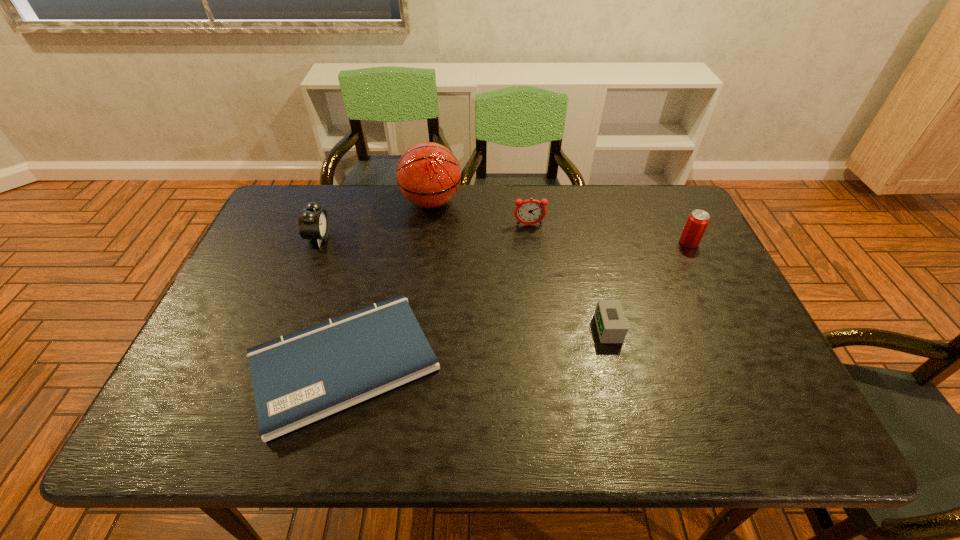
Point out which alarm clock is positioned as the nearest to the shortest object. Please provide its 2D coordinates. Your answer should be formatted as a tuple, i.e. [(x, y)], where the tuple contains the x and y coordinates of a point satisfying the conditions above.

[(313, 223)]

This screenshot has width=960, height=540. Find the location of `the closest alarm clock relative to the basketball`. the closest alarm clock relative to the basketball is located at coordinates (531, 211).

Find the location of a particular element. vacant area that satisfies the following two spatial constraints: 1. on the back side of the rightmost object; 2. on the front side of the leftmost alarm clock is located at coordinates (685, 238).

Find the location of a particular element. free spot that satisfies the following two spatial constraints: 1. on the front side of the leftmost alarm clock; 2. on the right side of the paperback book is located at coordinates coord(271,362).

You are a GUI agent. You are given a task and a screenshot of the screen. Output one action in this format:
    pyautogui.click(x=<x>, y=<y>)
    Task: Click on the free location that satisfies the following two spatial constraints: 1. on the back side of the rightmost object; 2. on the front side of the leftmost alarm clock
    
    Given the screenshot: What is the action you would take?
    pyautogui.click(x=685, y=238)

This screenshot has width=960, height=540. What are the coordinates of `free location that satisfies the following two spatial constraints: 1. on the front-facing side of the fourth object from left to right; 2. on the front side of the leftmost alarm clock` in the screenshot? It's located at (531, 238).

Identify the location of free region that satisfies the following two spatial constraints: 1. on the front side of the leftmost alarm clock; 2. on the back side of the rightmost object. Image resolution: width=960 pixels, height=540 pixels. [317, 243].